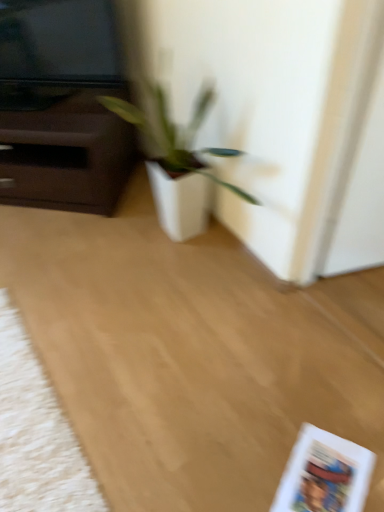
At what (x,y) coordinates should I click in order to perform the action: click on vacant region under white matte paperback book at lower right (from a real-world perspective). Please return your answer as a coordinate pair (x, y). This screenshot has height=512, width=384. Looking at the image, I should click on (334, 478).